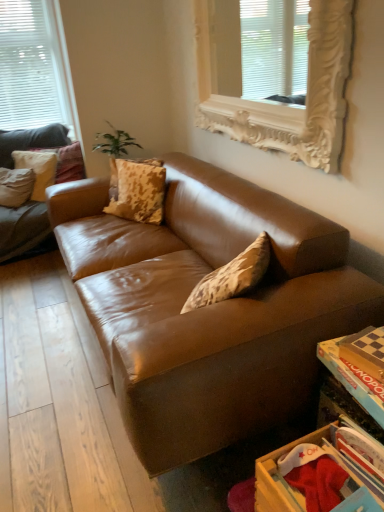
Question: From a real-world perspective, is white ornate frame at upper center, arranged as the 2th window when viewed from the left, located higher than white matte window at upper left, marked as the 2th window in a right-to-left arrangement?

Choices:
 (A) yes
 (B) no

Answer: (B)

Question: Is white ornate frame at upper center, arranged as the 2th window when viewed from the left, far away from white matte window at upper left, positioned as the first window in back-to-front order?

Choices:
 (A) yes
 (B) no

Answer: (A)

Question: Does white ornate frame at upper center, which is counted as the 1th window, starting from the right, have a lesser height compared to white matte window at upper left, which appears as the first window when viewed from the left?

Choices:
 (A) no
 (B) yes

Answer: (B)

Question: Considering the relative sizes of white ornate frame at upper center, arranged as the 2th window when viewed from the left, and white matte window at upper left, marked as the 2th window in a right-to-left arrangement, in the image provided, is white ornate frame at upper center, arranged as the 2th window when viewed from the left, smaller than white matte window at upper left, marked as the 2th window in a right-to-left arrangement,?

Choices:
 (A) no
 (B) yes

Answer: (A)

Question: Is white ornate frame at upper center, which appears as the 2th window when viewed from the back, located outside white matte window at upper left, marked as the 2th window in a right-to-left arrangement?

Choices:
 (A) yes
 (B) no

Answer: (A)

Question: Is white ornate frame at upper center, arranged as the 2th window when viewed from the left, surrounding white matte window at upper left, positioned as the first window in back-to-front order?

Choices:
 (A) no
 (B) yes

Answer: (A)

Question: Does white matte window at upper left, which appears as the 2th window when viewed from the front, have a greater height compared to matte beige pillow at upper left, the 1th pillow when ordered from back to front?

Choices:
 (A) yes
 (B) no

Answer: (A)

Question: From the image's perspective, is white matte window at upper left, marked as the 2th window in a right-to-left arrangement, above matte beige pillow at upper left, the 1th pillow when ordered from back to front?

Choices:
 (A) yes
 (B) no

Answer: (A)

Question: Is white matte window at upper left, positioned as the first window in back-to-front order, wider than matte beige pillow at upper left, which is counted as the third pillow, starting from the front?

Choices:
 (A) yes
 (B) no

Answer: (B)

Question: Is white matte window at upper left, which appears as the 2th window when viewed from the front, oriented towards matte beige pillow at upper left, arranged as the second pillow when viewed from the left?

Choices:
 (A) yes
 (B) no

Answer: (A)

Question: Does white matte window at upper left, which appears as the 2th window when viewed from the front, have a lesser width compared to matte beige pillow at upper left, arranged as the 2th pillow when viewed from the right?

Choices:
 (A) yes
 (B) no

Answer: (A)

Question: From the image's perspective, does white matte window at upper left, marked as the 2th window in a right-to-left arrangement, appear lower than matte beige pillow at upper left, which is counted as the third pillow, starting from the front?

Choices:
 (A) no
 (B) yes

Answer: (A)

Question: Can you confirm if white ornate frame at upper center, which is the first window from front to back, is wider than wooden drawer at lower right?

Choices:
 (A) yes
 (B) no

Answer: (B)